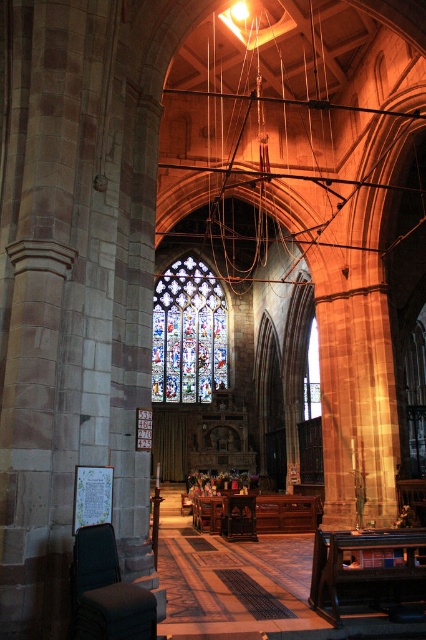
Who is positioned more to the right, matte black chair at lower left or stained glass at center?

Positioned to the right is stained glass at center.

Who is shorter, matte black chair at lower left or stained glass at center?

matte black chair at lower left is shorter.

Which is behind, point (97, 625) or point (319, 397)?

The point (319, 397) is more distant.

The image size is (426, 640). Find the location of `matte black chair at lower left`. matte black chair at lower left is located at coordinates (106, 592).

Is matte black chair at lower left below wooden polished chair at center?

No.

I want to click on matte black chair at lower left, so click(x=106, y=592).

Find the location of a particular element. matte black chair at lower left is located at coordinates (106, 592).

Locate an element on the screen. This screenshot has height=640, width=426. matte black chair at lower left is located at coordinates (106, 592).

Is point (244, 506) positioned in front of point (317, 392)?

Yes, it is.

This screenshot has width=426, height=640. Identify the location of wooden polished chair at center. (238, 516).